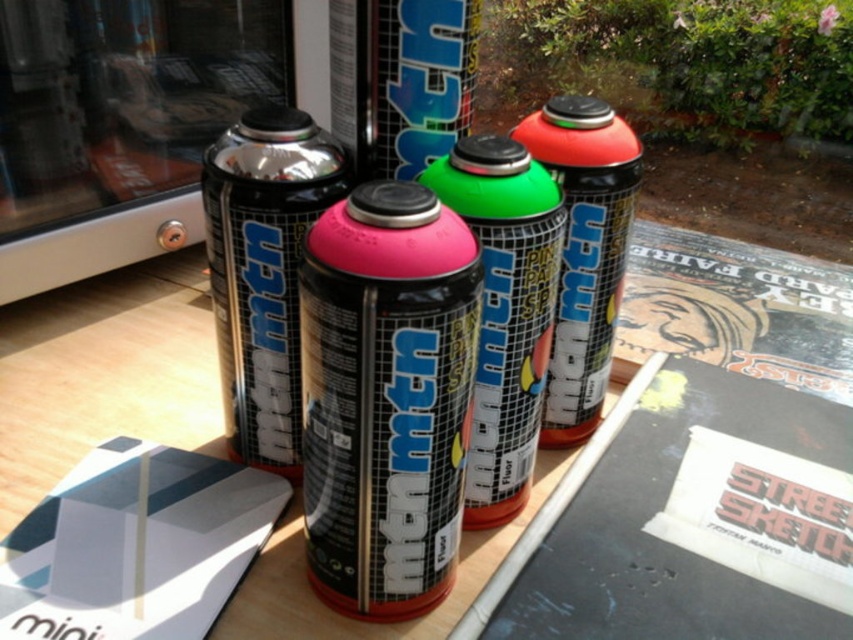
Based on the photo, you are organizing spray paint cans on a shelf and notice two cans labeled as metallic black spray can at center and matte black spray can at center. Which one is taller?

The matte black spray can at center is taller than the metallic black spray can at center.

You are an artist arranging spray cans on a desk. You have a green matte spray can at center and a matte black spray can at center. Which can is positioned lower on the desk?

The green matte spray can at center is located below the matte black spray can at center, so it is positioned lower on the desk.

You are an artist trying to choose a spray can for a detailed mural. You have two options in front of you on the table. The pink matte spray can at center and the green matte spray can at center. Which spray can should you pick if you need a smaller one for intricate details?

The pink matte spray can at center is smaller than the green matte spray can at center, so you should pick the pink matte spray can at center for intricate details.